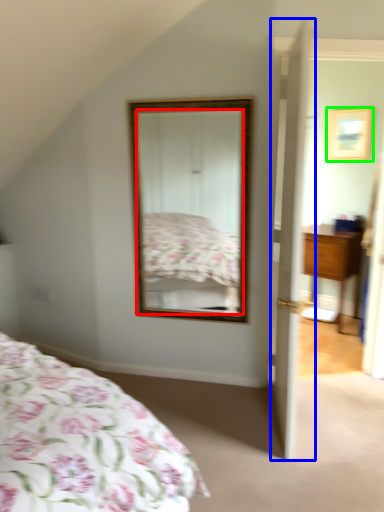
Question: Which object is the closest to the mirror (highlighted by a red box)? Choose among these: door (highlighted by a blue box) or picture frame (highlighted by a green box).

Choices:
 (A) door
 (B) picture frame

Answer: (A)